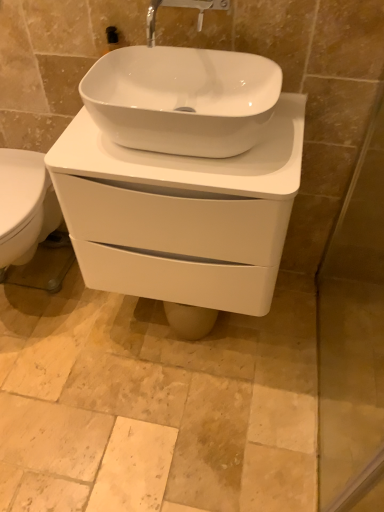
Image resolution: width=384 pixels, height=512 pixels. I want to click on free spot to the left of transparent glass screen door at right, so click(x=216, y=387).